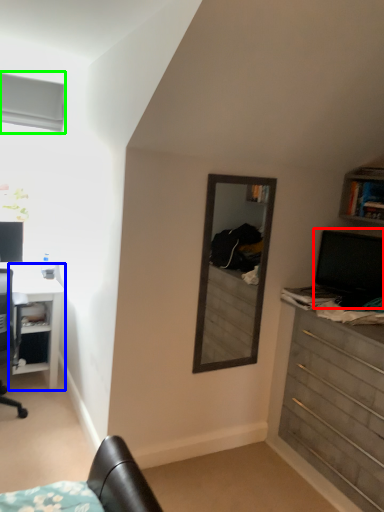
Question: Which object is positioned closest to computer monitor (highlighted by a red box)? Select from desk (highlighted by a blue box) and window (highlighted by a green box).

Choices:
 (A) desk
 (B) window

Answer: (A)